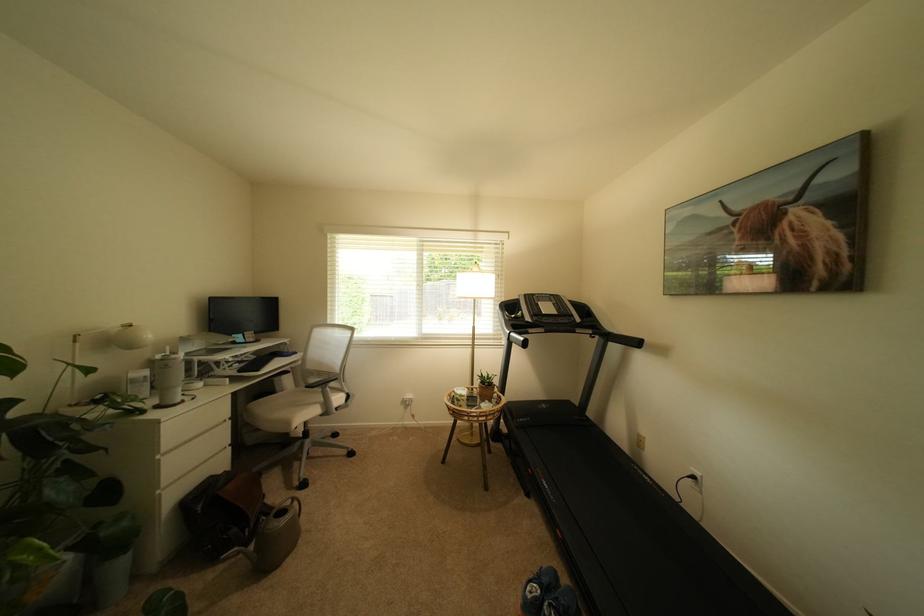
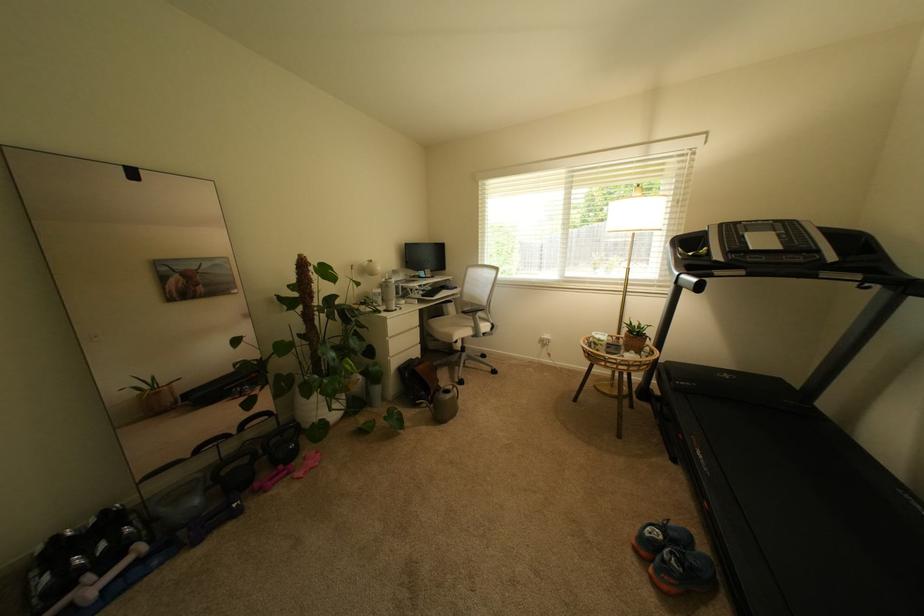
The point at [518,339] is marked in the first image. Where is the corresponding point in the second image?

(688, 283)